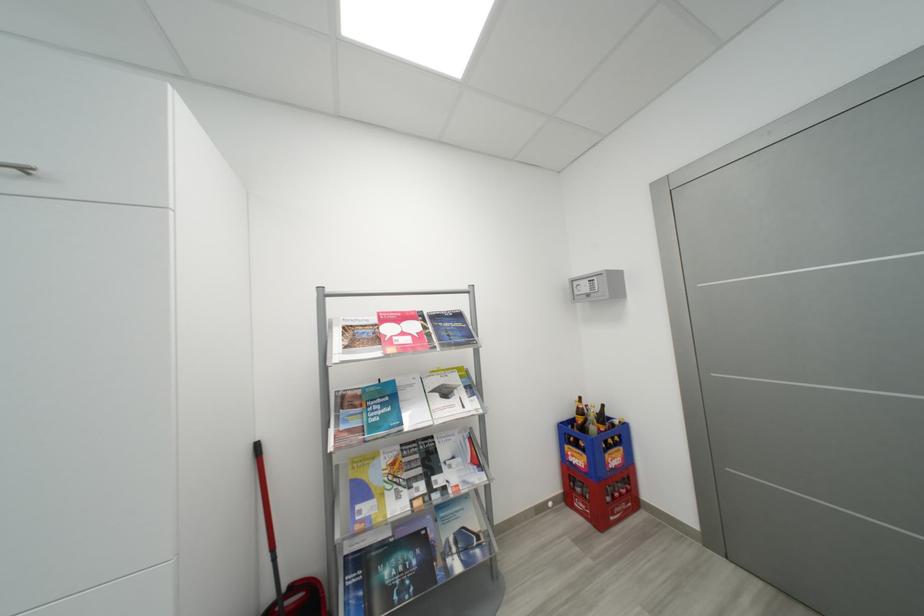
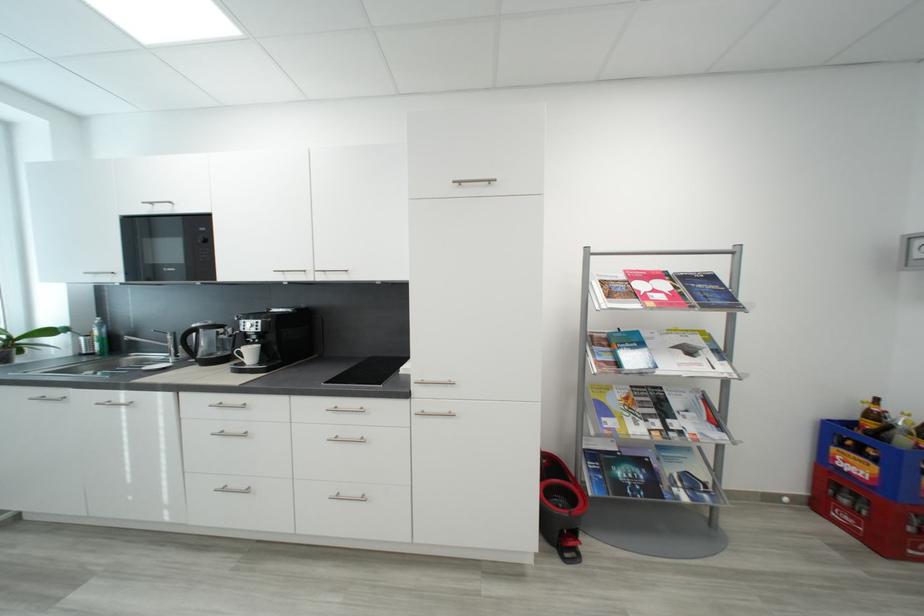
Question: I am providing you with two images of the same scene from different viewpoints. Please identify which objects are invisible in image2.

Choices:
 (A) blue plastic crate
 (B) white coffee cup
 (C) mop bucket pedal
 (D) none of these

Answer: (D)